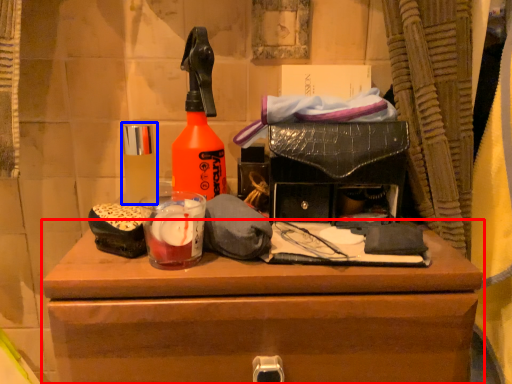
Question: Which object appears closest to the camera in this image, chest of drawers (highlighted by a red box) or toiletry (highlighted by a blue box)?

Choices:
 (A) chest of drawers
 (B) toiletry

Answer: (A)